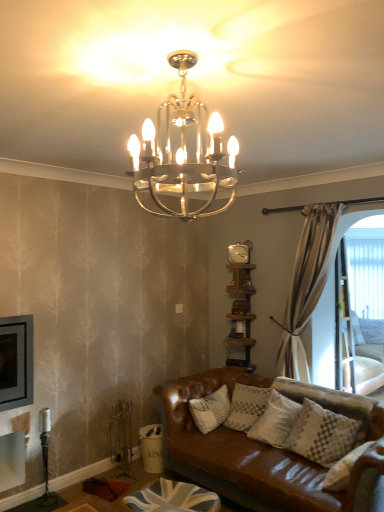
Question: In terms of width, does metallic chandelier at upper center look wider or thinner when compared to union jack fabric footrest at lower center?

Choices:
 (A) thin
 (B) wide

Answer: (A)

Question: From a real-world perspective, is metallic chandelier at upper center physically located above or below union jack fabric footrest at lower center?

Choices:
 (A) above
 (B) below

Answer: (A)

Question: Which of these objects is positioned closest to the brown wooden shelf at right?

Choices:
 (A) white mesh screen at right
 (B) union jack fabric footrest at lower center
 (C) metallic chandelier at upper center

Answer: (A)

Question: Which object is positioned farthest from the union jack fabric footrest at lower center?

Choices:
 (A) metallic chandelier at upper center
 (B) brown wooden shelf at right
 (C) white mesh screen at right

Answer: (C)